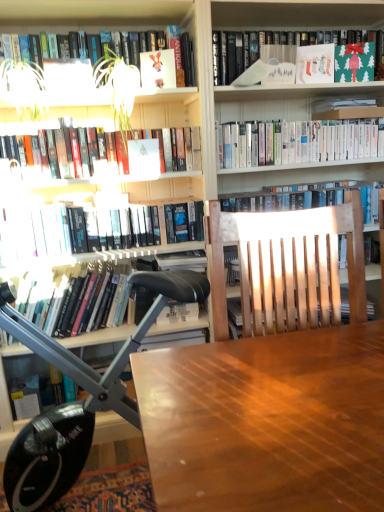
Find the location of a particular element. This screenshot has width=384, height=512. free space above hardcover books at upper left, placed as the fourth book when sorted from bottom to top (from a real-world perspective) is located at coordinates (89, 122).